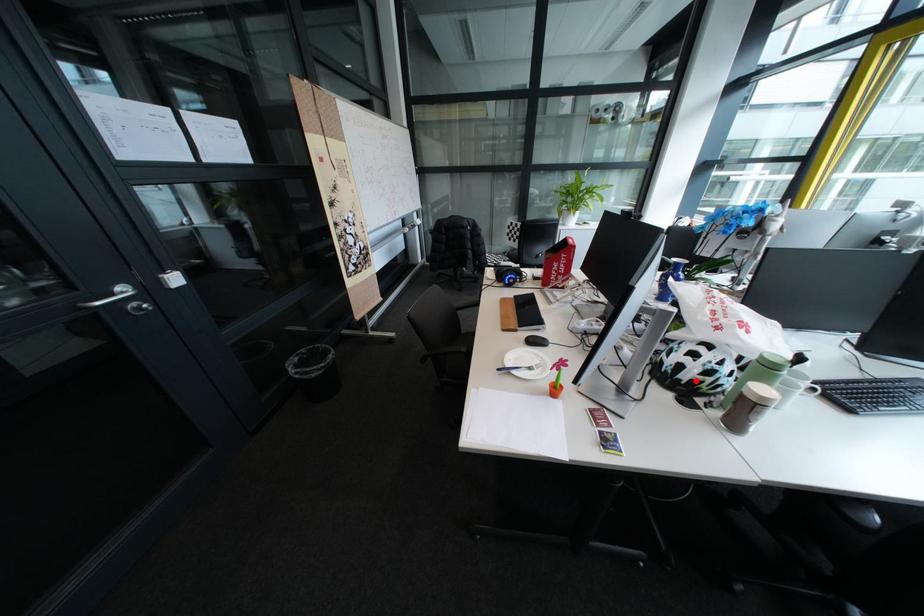
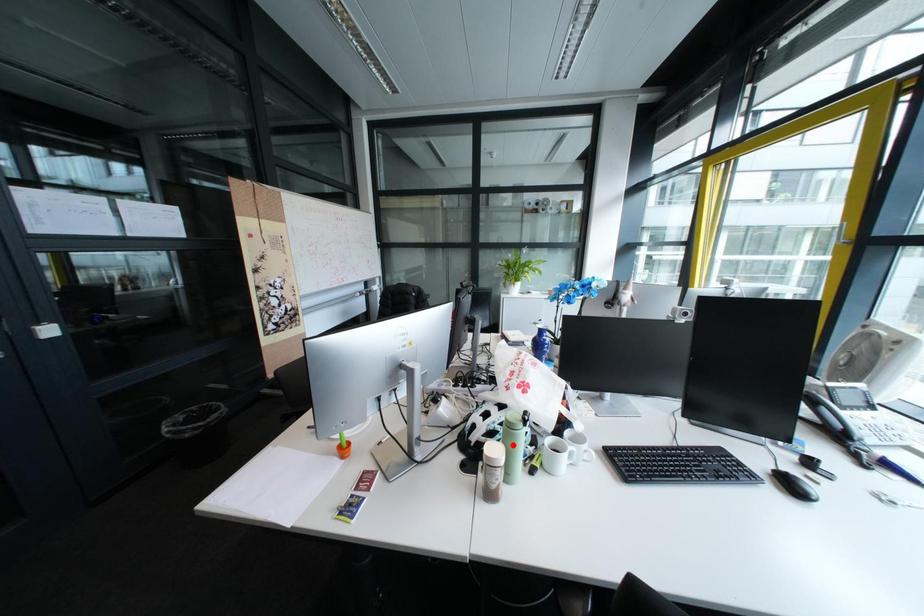
I am providing you with two images of the same scene from different viewpoints. A red point is marked on the first image and another point is marked on the second image. Do the highlighted points in image1 and image2 indicate the same real-world spot?

No